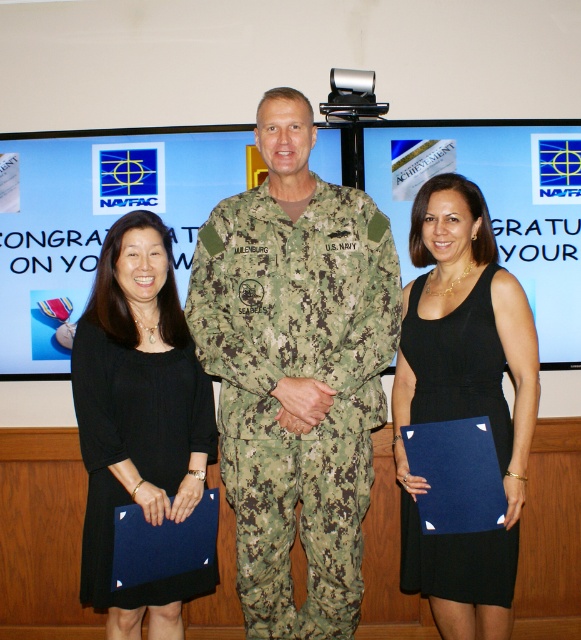
Is camouflage uniform at center positioned behind black matte dress at left?

No, camouflage uniform at center is in front of black matte dress at left.

Does camouflage uniform at center have a greater width compared to black matte dress at left?

Yes.

Does point (261, 113) come behind point (109, 488)?

Yes, point (261, 113) is farther from viewer.

Find the location of a particular element. The height and width of the screenshot is (640, 581). camouflage uniform at center is located at coordinates (295, 371).

Does black dress at center have a lesser width compared to black matte dress at left?

In fact, black dress at center might be wider than black matte dress at left.

Does black dress at center have a smaller size compared to black matte dress at left?

Incorrect, black dress at center is not smaller in size than black matte dress at left.

Between point (447, 582) and point (213, 412), which one is positioned behind?

The point (213, 412) is more distant.

Where is `black dress at center`? Image resolution: width=581 pixels, height=640 pixels. black dress at center is located at coordinates (464, 400).

Can you confirm if camouflage uniform at center is wider than black dress at center?

Yes, camouflage uniform at center is wider than black dress at center.

Find the location of `camouflage uniform at center`. camouflage uniform at center is located at coordinates (295, 371).